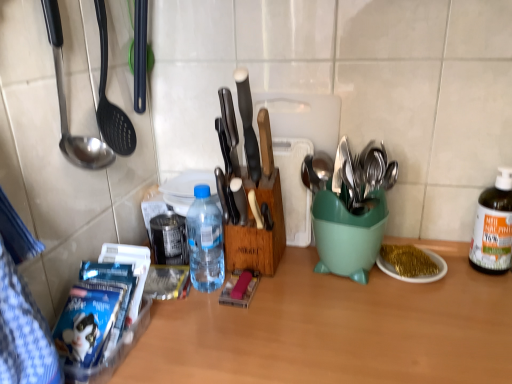
This screenshot has height=384, width=512. Identify the location of space that is in front of translucent plastic bottle at center, the first bottle from the left. (215, 334).